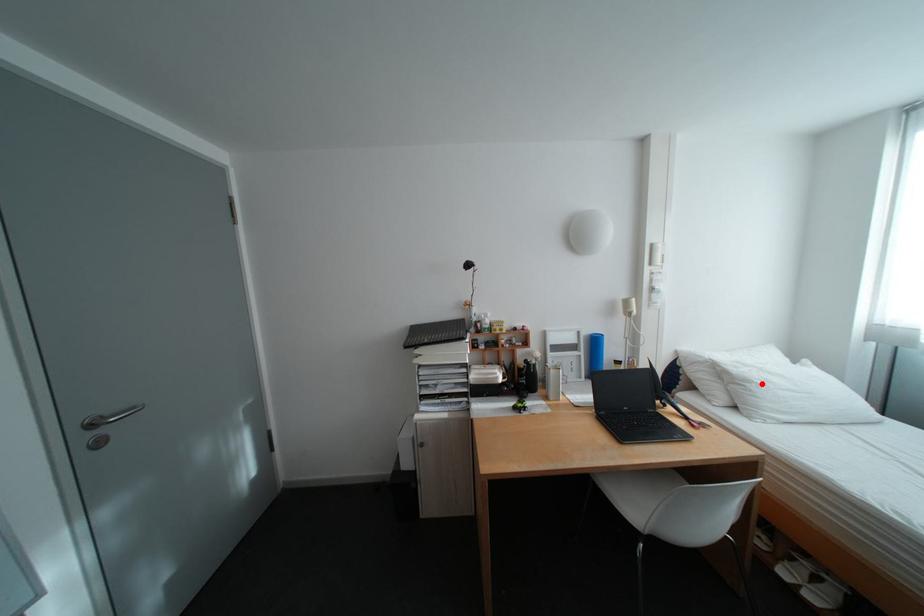
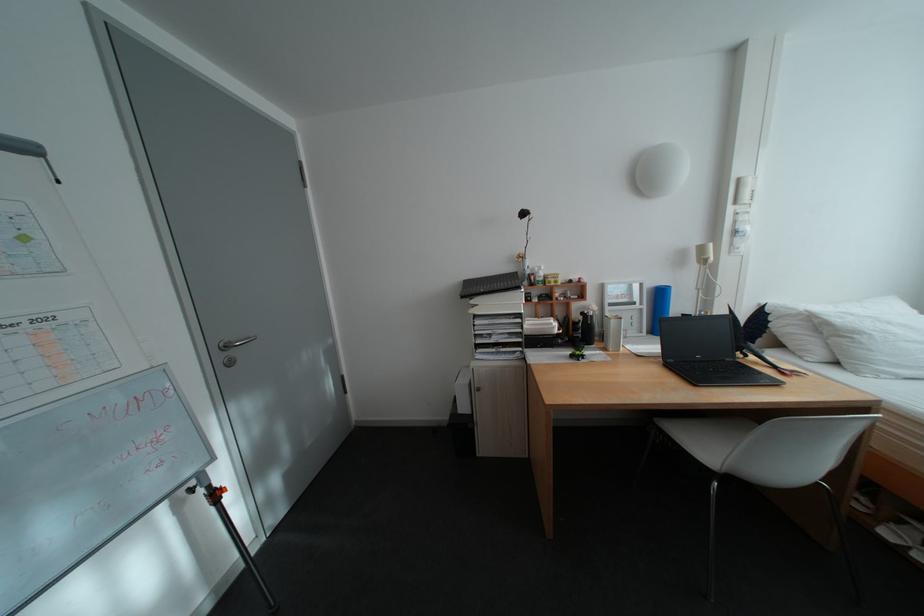
The point at the highlighted location is marked in the first image. Where is the corresponding point in the second image?

(871, 334)